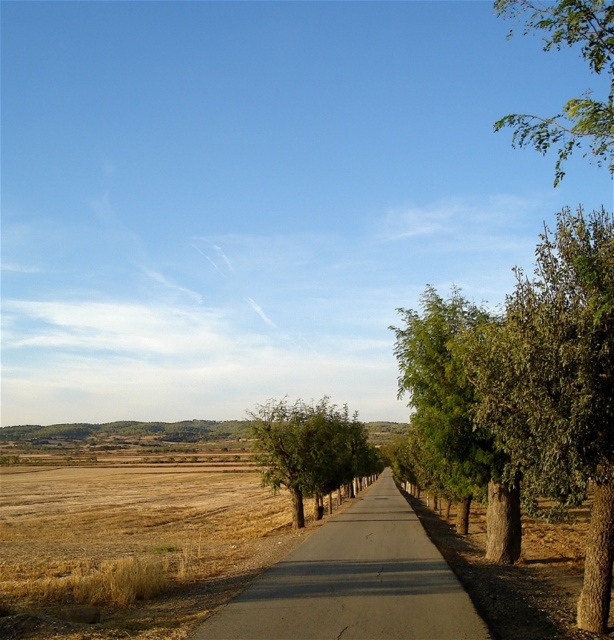
Question: Which point is closer to the camera taking this photo?

Choices:
 (A) (441, 440)
 (B) (335, 461)
 (C) (577, 115)

Answer: (C)

Question: Which object appears closest to the camera in this image?

Choices:
 (A) green leafy tree at center
 (B) asphalt road at center

Answer: (B)

Question: Can you confirm if asphalt road at center is positioned below green leafy tree at center?

Choices:
 (A) no
 (B) yes

Answer: (A)

Question: Which point is closer to the camera?

Choices:
 (A) green leafy tree at center-right
 (B) green leafy tree at center
 (C) asphalt road at center

Answer: (C)

Question: Observing the image, what is the correct spatial positioning of green leafy tree at right in reference to asphalt road at center?

Choices:
 (A) above
 (B) below

Answer: (A)

Question: Can you confirm if green leafy tree at right is wider than green leafy tree at center-right?

Choices:
 (A) no
 (B) yes

Answer: (B)